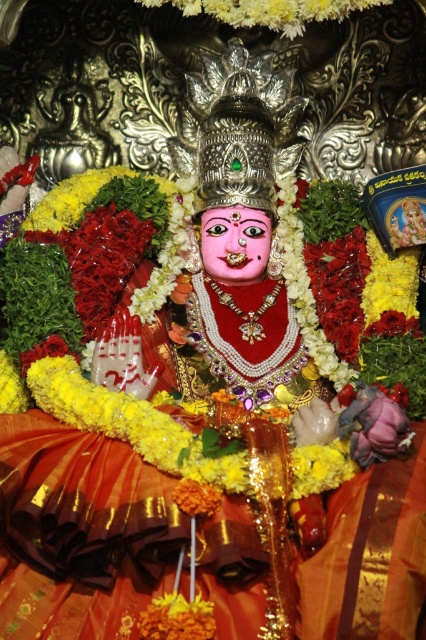
You are an artist trying to sketch the deity figure. You notice two yellow fabrics in the scene. Which one is closer to you, the yellow fabric at upper center or the yellow fabric flower at lower right?

The yellow fabric at upper center is closer to you because the yellow fabric flower at lower right is behind it.

You are an art conservator examining the deity figure. You notice a yellow fabric at upper center. Where exactly is this yellow fabric located on the deity figure?

The yellow fabric at upper center is located at point coordinates of 0.017 in the x and 0.634 in the y.